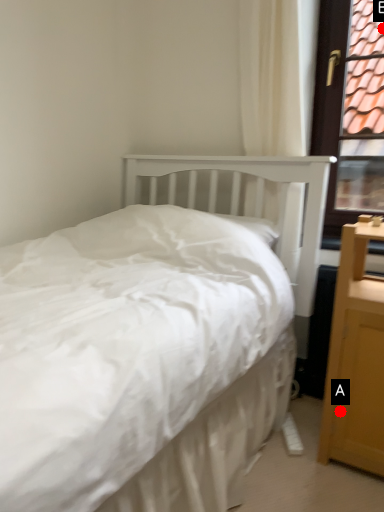
Question: Two points are circled on the image, labeled by A and B beside each circle. Which point is closer to the camera taking this photo?

Choices:
 (A) A is closer
 (B) B is closer

Answer: (A)